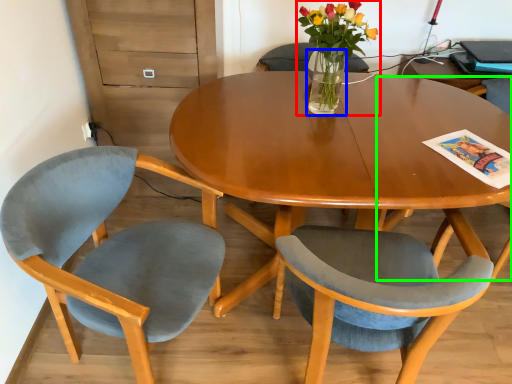
Question: Which is nearer to the houseplant (highlighted by a red box)? vase (highlighted by a blue box) or chair (highlighted by a green box).

Choices:
 (A) vase
 (B) chair

Answer: (A)